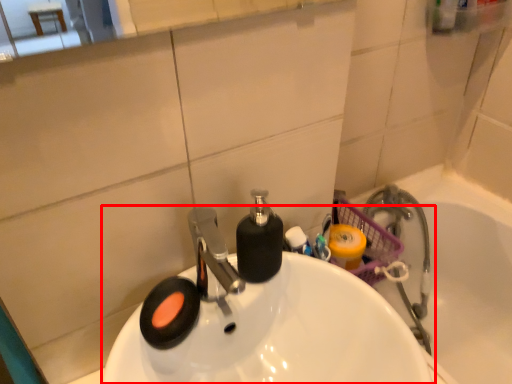
Question: Observing the image, what is the correct spatial positioning of sink (annotated by the red box) in reference to bath?

Choices:
 (A) left
 (B) right

Answer: (A)